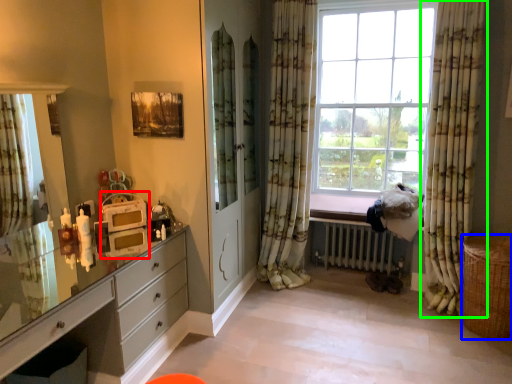
Question: Which is nearer to the appliance (highlighted by a red box)? basket (highlighted by a blue box) or curtain (highlighted by a green box).

Choices:
 (A) basket
 (B) curtain

Answer: (B)